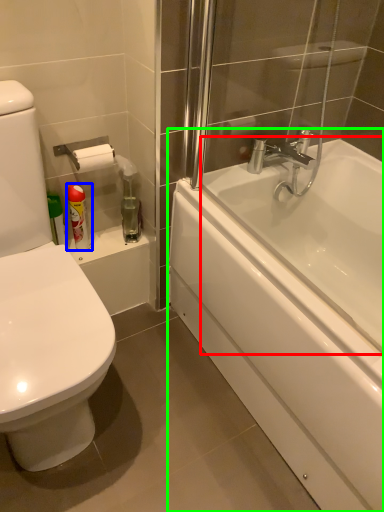
Question: Which is nearer to the bath (highlighted by a red box)? toiletry (highlighted by a blue box) or bathtub (highlighted by a green box).

Choices:
 (A) toiletry
 (B) bathtub

Answer: (B)